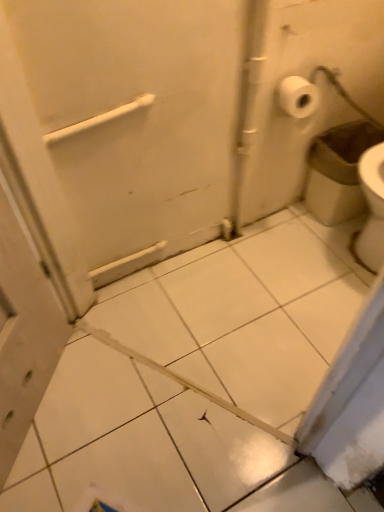
Describe the element at coordinates (338, 170) in the screenshot. I see `white plastic trash can at right` at that location.

Locate an element on the screen. white plastic trash can at right is located at coordinates (338, 170).

This screenshot has height=512, width=384. Find the location of `white plastic towel bar at upper center`. white plastic towel bar at upper center is located at coordinates (98, 120).

What is the approximate width of white plastic towel bar at upper center?

It is 1.65 inches.

Describe the element at coordinates (98, 120) in the screenshot. I see `white plastic towel bar at upper center` at that location.

What is the approximate height of white plastic towel bar at upper center?

It is 5.59 centimeters.

Image resolution: width=384 pixels, height=512 pixels. What are the coordinates of `white plastic trash can at right` in the screenshot? It's located at (338, 170).

Considering the positions of objects white plastic towel bar at upper center and white plastic trash can at right in the image provided, who is more to the left, white plastic towel bar at upper center or white plastic trash can at right?

Positioned to the left is white plastic towel bar at upper center.

Is white plastic towel bar at upper center closer to camera compared to white plastic trash can at right?

Yes, white plastic towel bar at upper center is closer to the camera.

Between point (46, 137) and point (332, 222), which one is positioned in front?

Positioned in front is point (46, 137).

From the image's perspective, relative to white plastic trash can at right, is white plastic towel bar at upper center above or below?

From the image's perspective, white plastic towel bar at upper center appears above white plastic trash can at right.

From a real-world perspective, relative to white plastic trash can at right, is white plastic towel bar at upper center vertically above or below?

In terms of real-world spatial position, white plastic towel bar at upper center is above white plastic trash can at right.

Consider the image. Which of these two, white plastic towel bar at upper center or white plastic trash can at right, is wider?

white plastic trash can at right.

Can you confirm if white plastic towel bar at upper center is taller than white plastic trash can at right?

In fact, white plastic towel bar at upper center may be shorter than white plastic trash can at right.

Is white plastic towel bar at upper center smaller than white plastic trash can at right?

Correct, white plastic towel bar at upper center occupies less space than white plastic trash can at right.

Do you think white plastic towel bar at upper center is within white plastic trash can at right, or outside of it?

white plastic towel bar at upper center is not enclosed by white plastic trash can at right.

Are white plastic towel bar at upper center and white plastic trash can at right far apart?

No, there isn't a large distance between white plastic towel bar at upper center and white plastic trash can at right.

Is white plastic towel bar at upper center looking in the opposite direction of white plastic trash can at right?

white plastic towel bar at upper center does not have its back to white plastic trash can at right.

You are a GUI agent. You are given a task and a screenshot of the screen. Output one action in this format:
    pyautogui.click(x=<x>, y=<y>)
    Task: Click on the towel bar above the white plastic trash can at right (from the image's perspective)
    This screenshot has height=512, width=384.
    Given the screenshot: What is the action you would take?
    pyautogui.click(x=98, y=120)

Consider the image. Would you say white plastic trash can at right is to the left or to the right of white plastic towel bar at upper center in the picture?

white plastic trash can at right is positioned on white plastic towel bar at upper center's right side.

In the scene shown: Is white plastic trash can at right behind white plastic towel bar at upper center?

Yes, white plastic trash can at right is further from the camera.

Is point (344, 148) closer to camera compared to point (143, 104)?

No, it is not.

From the image's perspective, is white plastic trash can at right positioned above or below white plastic towel bar at upper center?

white plastic trash can at right is below white plastic towel bar at upper center.

From a real-world perspective, which object rests below the other?

white plastic trash can at right is physically lower.

Is white plastic trash can at right wider than white plastic towel bar at upper center?

Correct, the width of white plastic trash can at right exceeds that of white plastic towel bar at upper center.

Between white plastic trash can at right and white plastic towel bar at upper center, which one has less height?

Standing shorter between the two is white plastic towel bar at upper center.

Looking at the image, does white plastic trash can at right seem bigger or smaller compared to white plastic towel bar at upper center?

Considering their sizes, white plastic trash can at right takes up more space than white plastic towel bar at upper center.

Is white plastic trash can at right located outside white plastic towel bar at upper center?

Yes, white plastic trash can at right is located beyond the bounds of white plastic towel bar at upper center.

Is the surface of white plastic trash can at right in direct contact with white plastic towel bar at upper center?

white plastic trash can at right and white plastic towel bar at upper center are not in contact.

Is white plastic trash can at right aimed at white plastic towel bar at upper center?

No.

Can you tell me how much white plastic trash can at right and white plastic towel bar at upper center differ in facing direction?

They differ by 3.05 degrees in their facing directions.

Image resolution: width=384 pixels, height=512 pixels. I want to click on garbage located on the right of white plastic towel bar at upper center, so pyautogui.click(x=338, y=170).

Locate an element on the screen. This screenshot has width=384, height=512. garbage below the white plastic towel bar at upper center (from a real-world perspective) is located at coordinates click(338, 170).

You are a GUI agent. You are given a task and a screenshot of the screen. Output one action in this format:
    pyautogui.click(x=<x>, y=<y>)
    Task: Click on the towel bar above the white plastic trash can at right (from a real-world perspective)
    
    Given the screenshot: What is the action you would take?
    pyautogui.click(x=98, y=120)